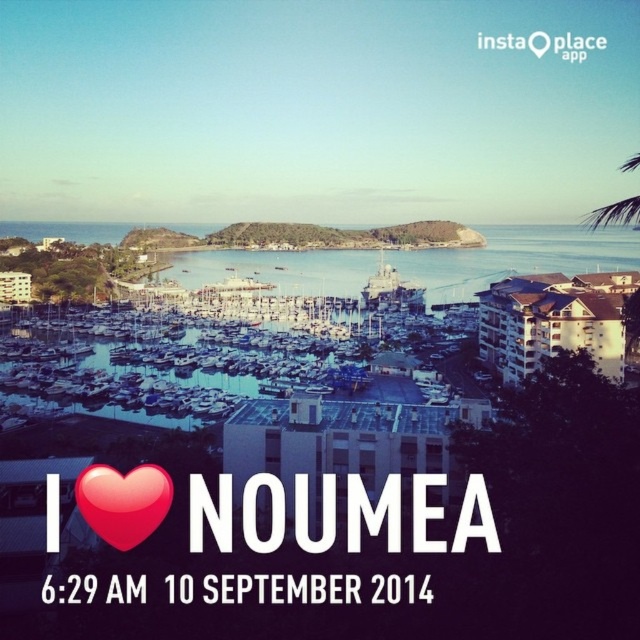
Question: Does blue water at center have a larger size compared to red glossy heart at center?

Choices:
 (A) no
 (B) yes

Answer: (B)

Question: Does blue water at center have a larger size compared to red glossy heart at center?

Choices:
 (A) no
 (B) yes

Answer: (B)

Question: Which point is farther to the camera?

Choices:
 (A) red glossy heart at center
 (B) blue water at center

Answer: (B)

Question: Can you confirm if blue water at center is positioned below red glossy heart at center?

Choices:
 (A) yes
 (B) no

Answer: (B)